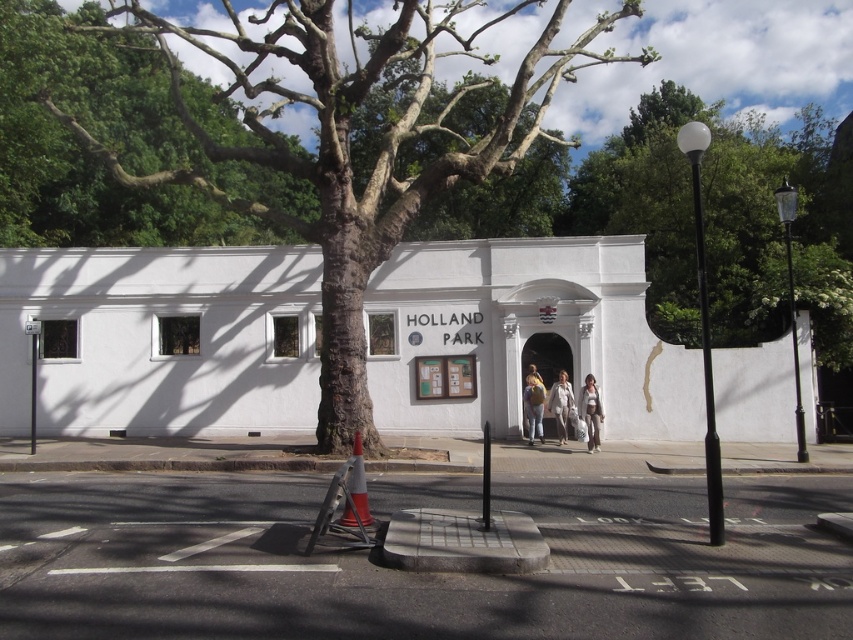
Question: Which object is the farthest from the matte beige backpack at center?

Choices:
 (A) green leafy tree at upper center
 (B) orange reflective cone at lower center
 (C) green leafy tree at upper left
 (D) green textured tree at center

Answer: (D)

Question: Does orange reflective cone at lower center appear under matte beige backpack at center?

Choices:
 (A) no
 (B) yes

Answer: (A)

Question: Which of the following is the closest to the observer?

Choices:
 (A) green textured tree at center
 (B) orange reflective cone at lower center
 (C) green leafy tree at upper left
 (D) matte beige backpack at center

Answer: (B)

Question: Can you confirm if light beige pants at center is wider than matte beige backpack at center?

Choices:
 (A) yes
 (B) no

Answer: (B)

Question: Which of the following is the farthest from the observer?

Choices:
 (A) (352, 484)
 (B) (558, 416)
 (C) (206, 104)

Answer: (C)

Question: Can you confirm if green textured tree at center is positioned to the right of light beige coat at center?

Choices:
 (A) no
 (B) yes

Answer: (A)